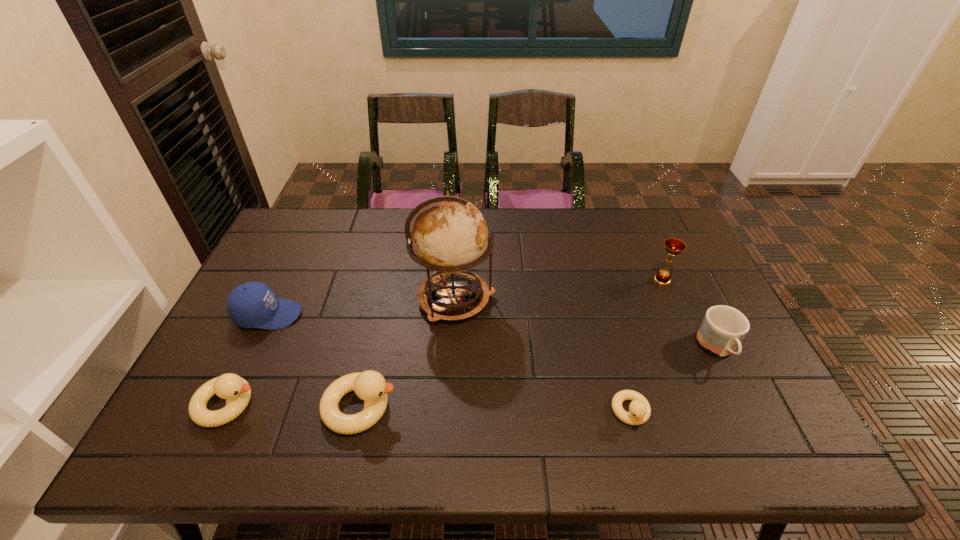
The image size is (960, 540). Find the location of `vacant area that lies between the mug and the tallest object`. vacant area that lies between the mug and the tallest object is located at coordinates (587, 324).

The width and height of the screenshot is (960, 540). I want to click on free space between the tallest object and the second duckling from left to right, so click(x=408, y=353).

Locate an element on the screen. empty space between the second duckling from left to right and the second shortest duckling is located at coordinates (294, 406).

Image resolution: width=960 pixels, height=540 pixels. I want to click on object that stands as the second closest to the second duckling from left to right, so click(450, 235).

The width and height of the screenshot is (960, 540). What are the coordinates of `object that is the fifth closest to the mug` in the screenshot? It's located at (252, 304).

The height and width of the screenshot is (540, 960). I want to click on the third closest duckling to the chalice, so click(236, 391).

Identify which duckling is the third nearest to the tallest object. Please provide its 2D coordinates. Your answer should be formatted as a tuple, i.e. [(x, y)], where the tuple contains the x and y coordinates of a point satisfying the conditions above.

[(236, 391)]

Locate an element on the screen. The width and height of the screenshot is (960, 540). free space that satisfies the following two spatial constraints: 1. on the front side of the chalice; 2. at the center of the globe is located at coordinates (670, 299).

This screenshot has height=540, width=960. Identify the location of free location that satisfies the following two spatial constraints: 1. on the front side of the chalice; 2. at the beak of the second shortest duckling. (717, 404).

Identify the location of free spot that satisfies the following two spatial constraints: 1. on the side with the handle of the mug; 2. at the beak of the second duckling from right to left. (746, 407).